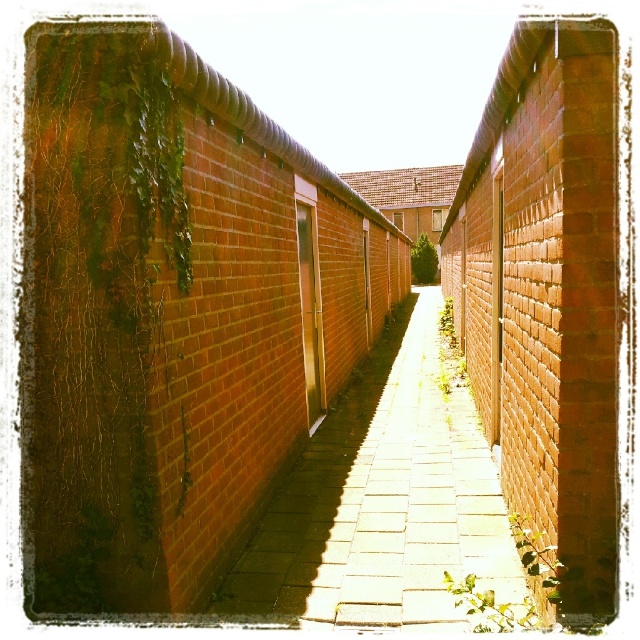
Question: Observing the image, what is the correct spatial positioning of green leafy ivy at left in reference to brick paved path at center?

Choices:
 (A) above
 (B) below

Answer: (A)

Question: Which object appears closest to the camera in this image?

Choices:
 (A) brick paved path at center
 (B) green leafy ivy at left

Answer: (B)

Question: Which of the following is the farthest from the observer?

Choices:
 (A) green leafy ivy at left
 (B) brick paved path at center

Answer: (B)

Question: Is green leafy ivy at left to the right of brick paved path at center from the viewer's perspective?

Choices:
 (A) no
 (B) yes

Answer: (A)

Question: Can you confirm if green leafy ivy at left is positioned to the right of brick paved path at center?

Choices:
 (A) yes
 (B) no

Answer: (B)